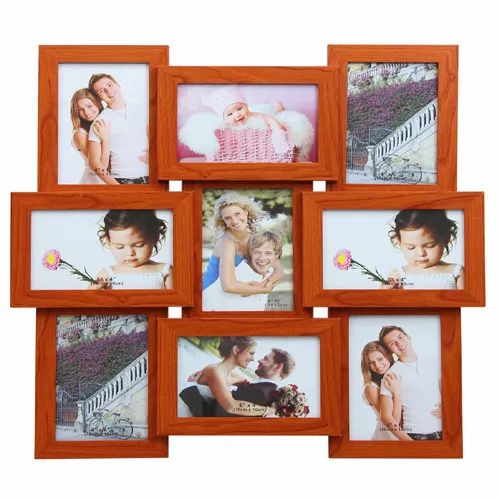
The height and width of the screenshot is (500, 500). What are the coordinates of `frames` in the screenshot? It's located at (122, 148), (222, 131), (382, 121), (215, 263), (145, 255), (95, 400), (203, 380), (422, 379).